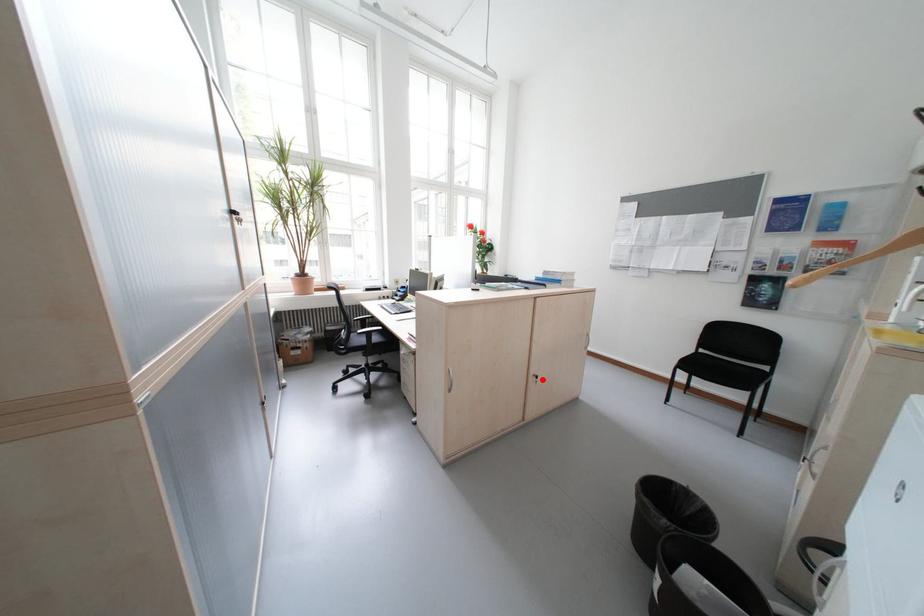
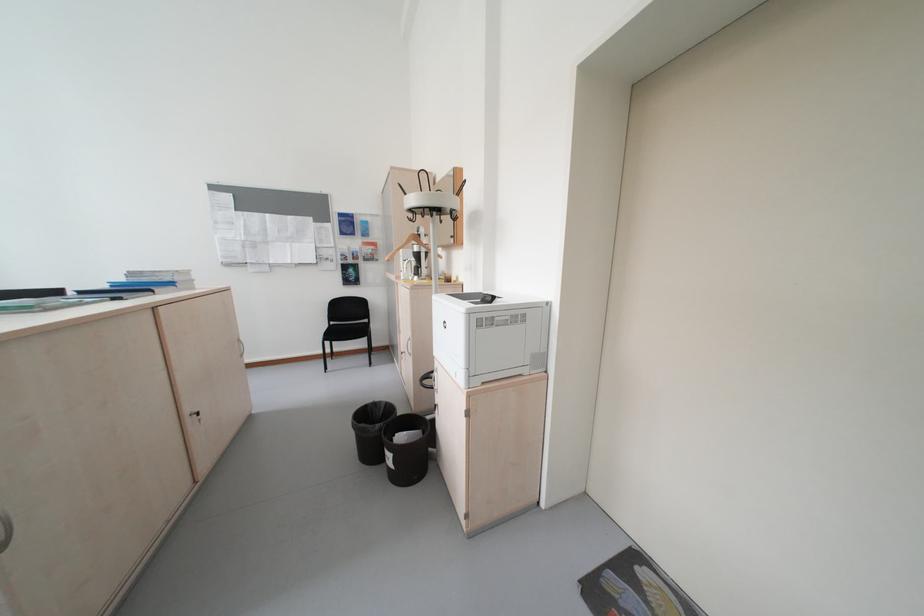
Locate, in the second image, the point that corresponds to the highlighted location in the first image.

(200, 421)